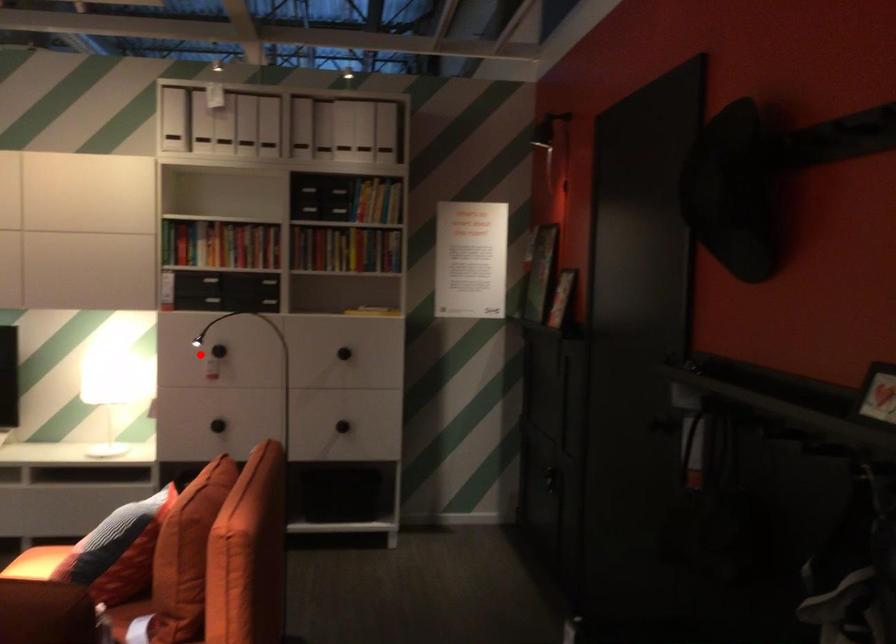
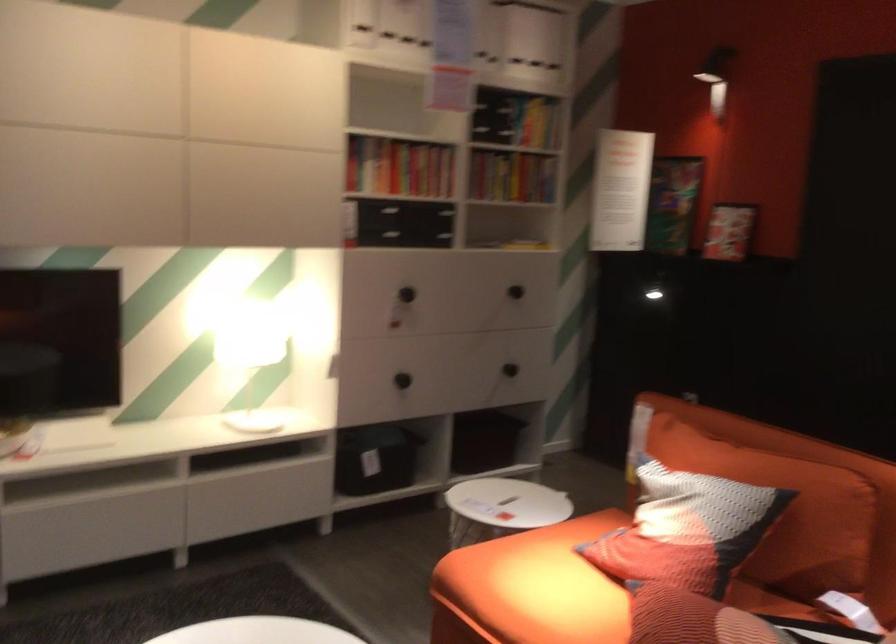
Find the pixel in the second image that matches the highlighted location in the first image.

(407, 294)